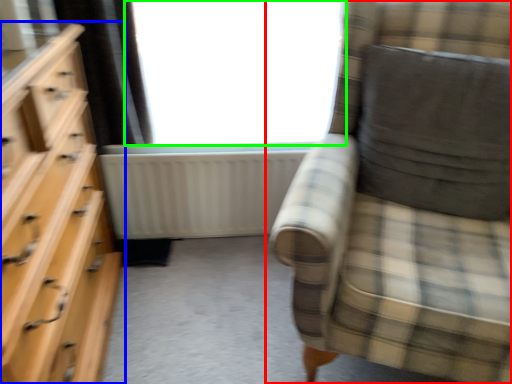
Question: Estimate the real-world distances between objects in this image. Which object is farther from chair (highlighted by a red box), chest of drawers (highlighted by a blue box) or window (highlighted by a green box)?

Choices:
 (A) chest of drawers
 (B) window

Answer: (A)